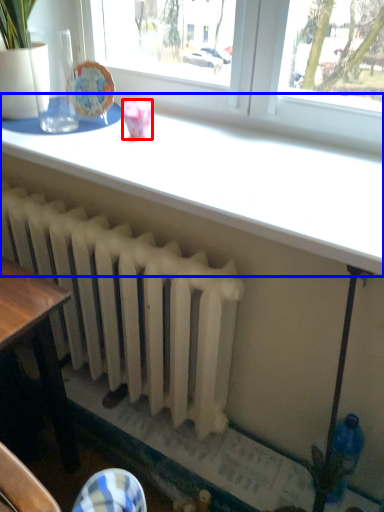
Question: Which point is further to the camera, tableware (highlighted by a red box) or table (highlighted by a blue box)?

Choices:
 (A) tableware
 (B) table

Answer: (A)